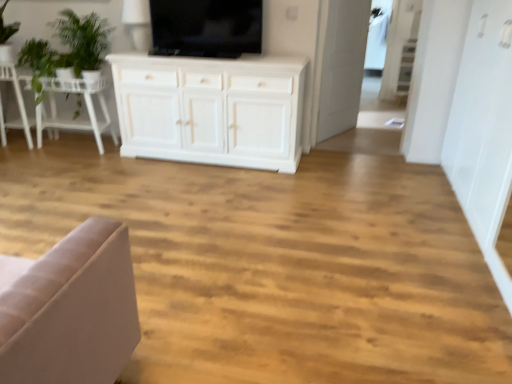
Question: Considering the relative sizes of green leafy plant at upper left and black glossy tv at upper center in the image provided, is green leafy plant at upper left taller than black glossy tv at upper center?

Choices:
 (A) yes
 (B) no

Answer: (A)

Question: From the image's perspective, is green leafy plant at upper left located above black glossy tv at upper center?

Choices:
 (A) yes
 (B) no

Answer: (B)

Question: Can you confirm if green leafy plant at upper left is smaller than black glossy tv at upper center?

Choices:
 (A) yes
 (B) no

Answer: (B)

Question: Can you confirm if green leafy plant at upper left is shorter than black glossy tv at upper center?

Choices:
 (A) no
 (B) yes

Answer: (A)

Question: From a real-world perspective, is green leafy plant at upper left located beneath black glossy tv at upper center?

Choices:
 (A) no
 (B) yes

Answer: (B)

Question: Considering the positions of point (1, 64) and point (89, 122), is point (1, 64) closer or farther from the camera than point (89, 122)?

Choices:
 (A) closer
 (B) farther

Answer: (A)

Question: Considering the positions of green fabric chair at left and white wooden table at left in the image, is green fabric chair at left wider or thinner than white wooden table at left?

Choices:
 (A) thin
 (B) wide

Answer: (A)

Question: Is green fabric chair at left taller or shorter than white wooden table at left?

Choices:
 (A) short
 (B) tall

Answer: (B)

Question: In terms of size, does green fabric chair at left appear bigger or smaller than white wooden table at left?

Choices:
 (A) small
 (B) big

Answer: (A)

Question: From a real-world perspective, is green leafy plant at upper left positioned above or below black glossy tv at upper center?

Choices:
 (A) above
 (B) below

Answer: (B)

Question: From the image's perspective, is green leafy plant at upper left located above or below black glossy tv at upper center?

Choices:
 (A) above
 (B) below

Answer: (B)

Question: Is green leafy plant at upper left inside or outside of black glossy tv at upper center?

Choices:
 (A) inside
 (B) outside

Answer: (B)

Question: Would you say green leafy plant at upper left is to the left or to the right of black glossy tv at upper center in the picture?

Choices:
 (A) right
 (B) left

Answer: (B)

Question: Based on their positions, is black glossy tv at upper center located to the left or right of transparent glass door at upper right?

Choices:
 (A) right
 (B) left

Answer: (B)

Question: Is black glossy tv at upper center taller or shorter than transparent glass door at upper right?

Choices:
 (A) short
 (B) tall

Answer: (A)